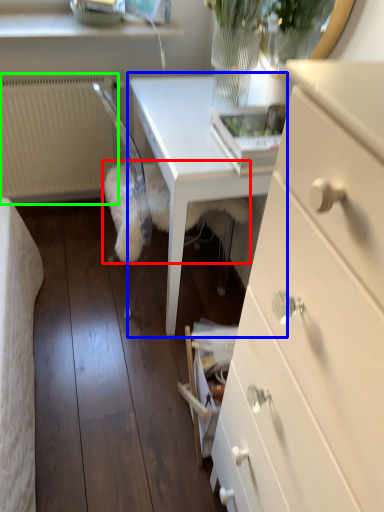
Question: Based on their relative distances, which object is nearer to animal (highlighted by a red box)? Choose from table (highlighted by a blue box) and radiator (highlighted by a green box).

Choices:
 (A) table
 (B) radiator

Answer: (A)